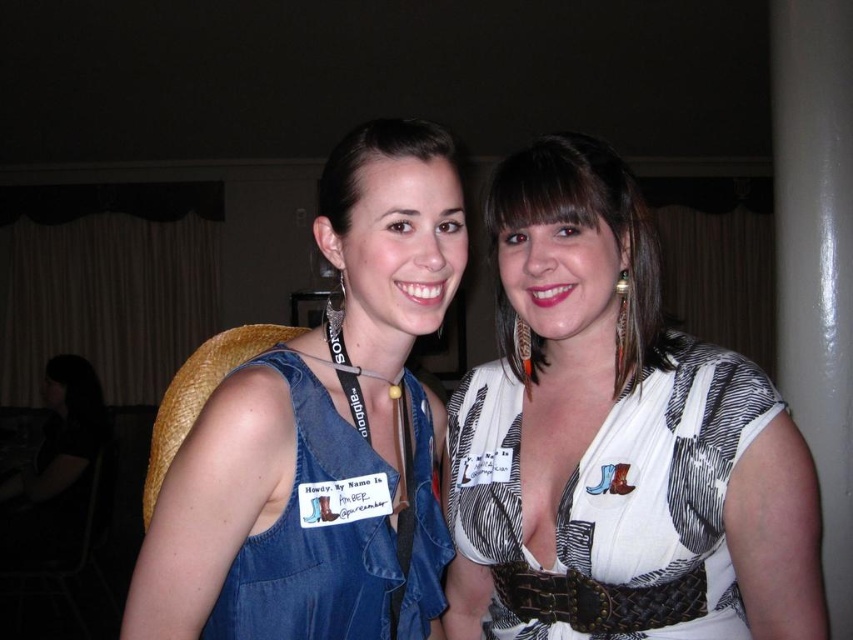
Question: Which point is farther from the camera taking this photo?

Choices:
 (A) (364, 540)
 (B) (368, 156)

Answer: (A)

Question: Does denim dress at center appear under matte black hair at center?

Choices:
 (A) yes
 (B) no

Answer: (A)

Question: Is denim dress at center thinner than white textured blouse at center?

Choices:
 (A) yes
 (B) no

Answer: (B)

Question: Is denim dress at center positioned in front of white textured blouse at center?

Choices:
 (A) no
 (B) yes

Answer: (B)

Question: Which object is closer to the camera taking this photo?

Choices:
 (A) matte black hair at center
 (B) denim dress at center
 (C) white textured blouse at center
 (D) white printed dress at center

Answer: (B)

Question: Which of the following is the closest to the observer?

Choices:
 (A) white printed dress at center
 (B) white textured blouse at center
 (C) denim vest at left

Answer: (C)